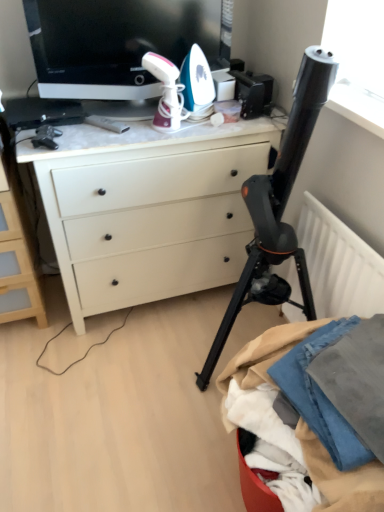
This screenshot has height=512, width=384. I want to click on free area below white matte chest of drawers at left (from a real-world perspective), so click(x=31, y=320).